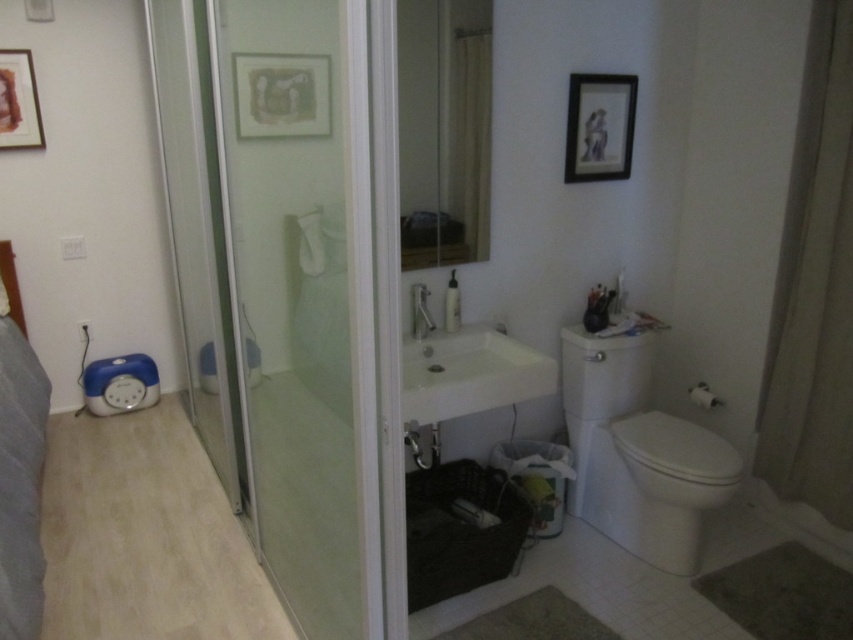
You are organizing a small party in the bathroom and need to hang decorations. You have a beige fabric curtain at right and a matte black picture frame at upper center. Which object has a smaller width and is better suited for hanging in a narrow space?

The beige fabric curtain at right has a lesser width compared to the matte black picture frame at upper center, making it better suited for hanging in a narrow space.

You are standing in the bathroom and want to reach the point at coordinates point (779, 426). Can you safely walk towards it without any obstacles?

The distance between you and the point (779, 426) is 2.63 meters, so yes, you can safely walk towards it as there are no obstacles mentioned in the scene description.

You are a guest in this bathroom and want to hang a new picture frame. The current frames are the matte black picture frame at upper center and the wooden framed artwork at upper left. Which frame is closer to the ceiling?

The wooden framed artwork at upper left is closer to the ceiling since the matte black picture frame at upper center is located below it.